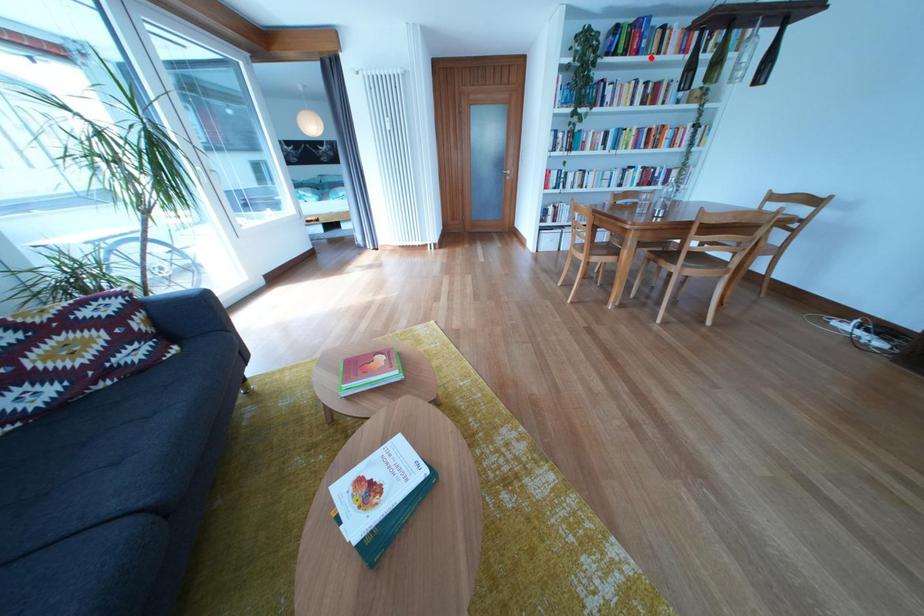
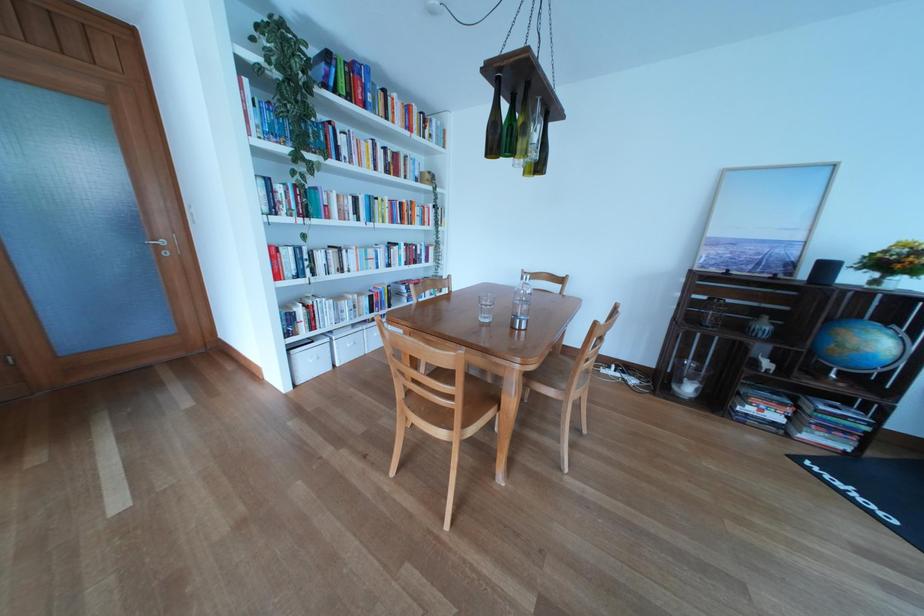
Question: I am providing you with two images of the same scene from different viewpoints. Given a red point in image1, look at the same physical point in image2. Is it:

Choices:
 (A) Closer to the viewpoint
 (B) Farther from the viewpoint

Answer: (A)